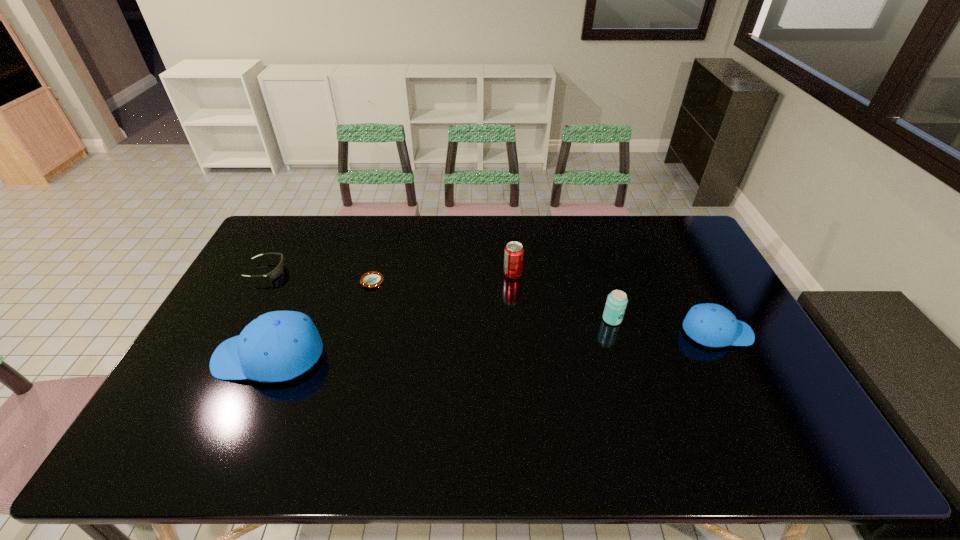
This screenshot has width=960, height=540. What are the coordinates of `vacant space positioned 0.060m on the front-facing side of the left cap` in the screenshot? It's located at (194, 356).

Identify the location of free space located on the lenses of the goggles. (377, 271).

Find the location of a particular element. vacant point located 0.260m on the left of the compass is located at coordinates (281, 282).

Image resolution: width=960 pixels, height=540 pixels. Identify the location of blank space located 0.120m on the left of the beer can. (563, 319).

I want to click on vacant area situated 0.090m on the front of the fifth shortest object, so click(515, 300).

Identify the location of cap at the left edge. This screenshot has height=540, width=960. pyautogui.click(x=277, y=346).

I want to click on goggles at the left edge, so click(x=278, y=270).

At what (x,y) coordinates should I click in order to perform the action: click on object present at the right edge. Please return your answer as a coordinate pair (x, y). The height and width of the screenshot is (540, 960). Looking at the image, I should click on (712, 325).

This screenshot has width=960, height=540. In the image, there is a desktop. In order to click on free space at the far edge in this screenshot , I will do `click(343, 237)`.

Locate an element on the screen. Image resolution: width=960 pixels, height=540 pixels. free location at the near edge is located at coordinates (481, 417).